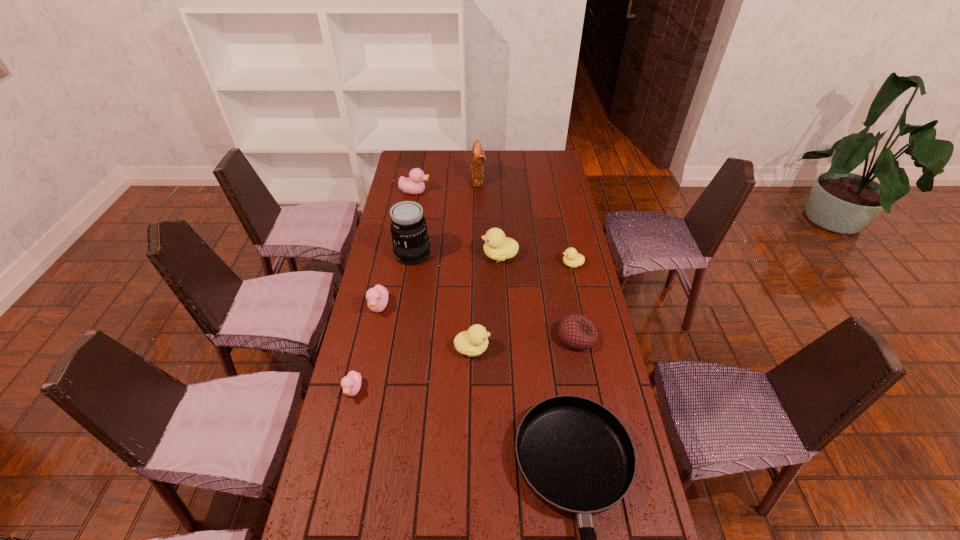
At what (x,y) coordinates should I click in order to perform the action: click on the tallest object. Please return your answer as a coordinate pair (x, y). Image resolution: width=960 pixels, height=540 pixels. Looking at the image, I should click on (408, 226).

You are a GUI agent. You are given a task and a screenshot of the screen. Output one action in this format:
    pyautogui.click(x=<x>, y=<y>)
    Task: Click on the clutch bag
    The image size is (960, 540).
    Given the screenshot: What is the action you would take?
    pyautogui.click(x=477, y=157)

The height and width of the screenshot is (540, 960). In order to click on the biggest yellow duckling in this screenshot , I will do `click(497, 246)`.

Locate an element on the screen. the farthest pink duckling is located at coordinates (414, 184).

The width and height of the screenshot is (960, 540). In order to click on the biggest pink duckling in this screenshot , I will do `click(414, 184)`.

Where is `the nearest yellow duckling`? The image size is (960, 540). the nearest yellow duckling is located at coordinates (473, 342).

This screenshot has width=960, height=540. Identify the location of the second nearest duckling. (473, 342).

Identify the location of the sixth farthest object. The image size is (960, 540). click(377, 297).

Identify the location of the second nearest pink duckling. (377, 297).

Where is `beanbag`? This screenshot has height=540, width=960. beanbag is located at coordinates (577, 332).